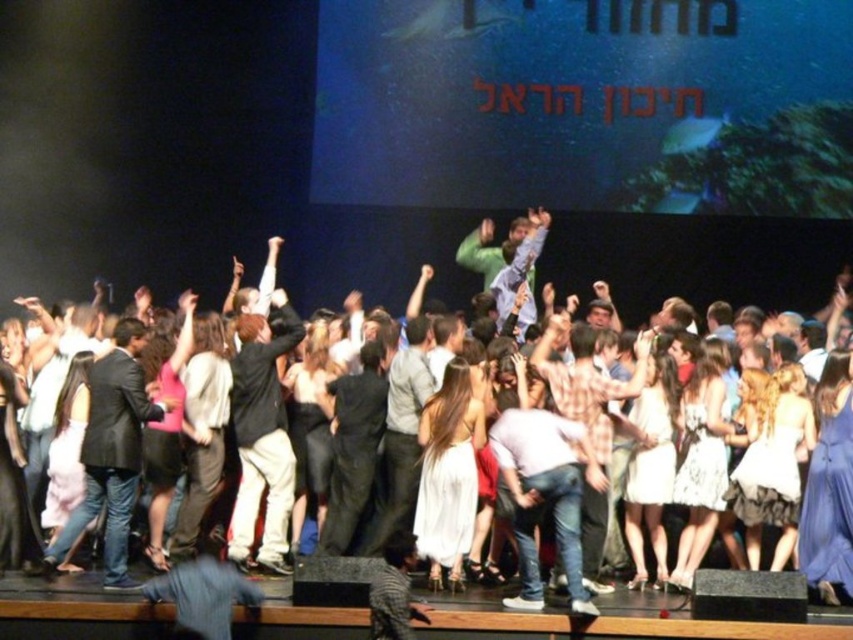
You are a photographer at the Israel Prize ceremony. You want to take a photo that includes both the point at (x=573, y=358) and the point at (x=206, y=369). Which point should you focus on first to ensure both are in the frame?

A: You should focus on point (x=206, y=369) first because it is closer to the viewer than point (x=573, y=358), which is behind it. By starting with the closer point, you can adjust the camera to include both in the frame.

You are a photographer at the Israel Prize Ceremony. You need to capture a photo that includes both the white satin dress at center and the light brown leather jacket at center. Which object should you position to the left side of your frame to ensure both are in the shot?

The light brown leather jacket at center should be positioned to the left side of your frame because the white satin dress at center is to the right of it, ensuring both are included in the shot.

You are a photographer at the Israel Prize Ceremony. You need to capture a photo that includes both the dark gray suit at center and the plaid fabric shirt at center. Which of the two should you focus on to ensure they both fit in the frame?

The dark gray suit at center occupies less space than the plaid fabric shirt at center, so focusing on the plaid fabric shirt at center will ensure both fit in the frame.